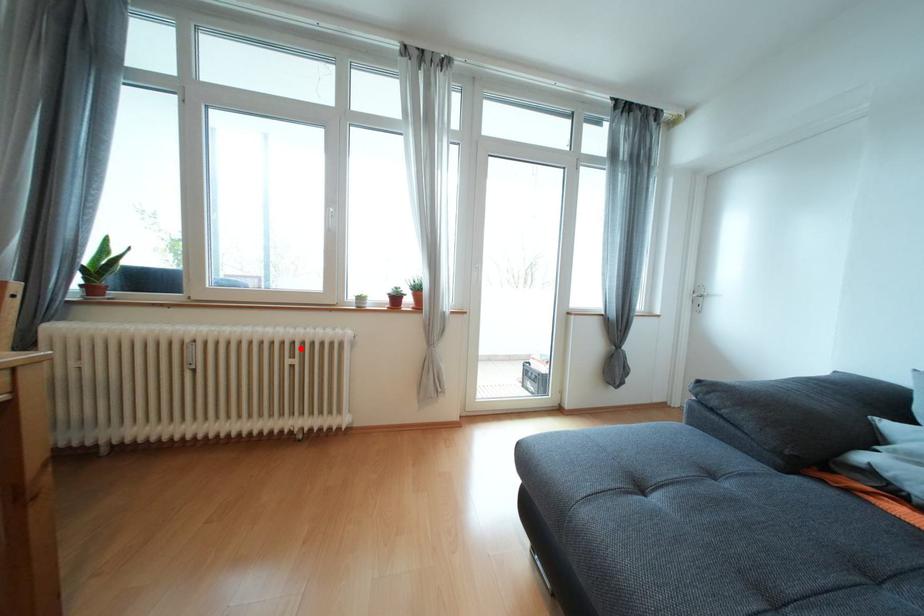
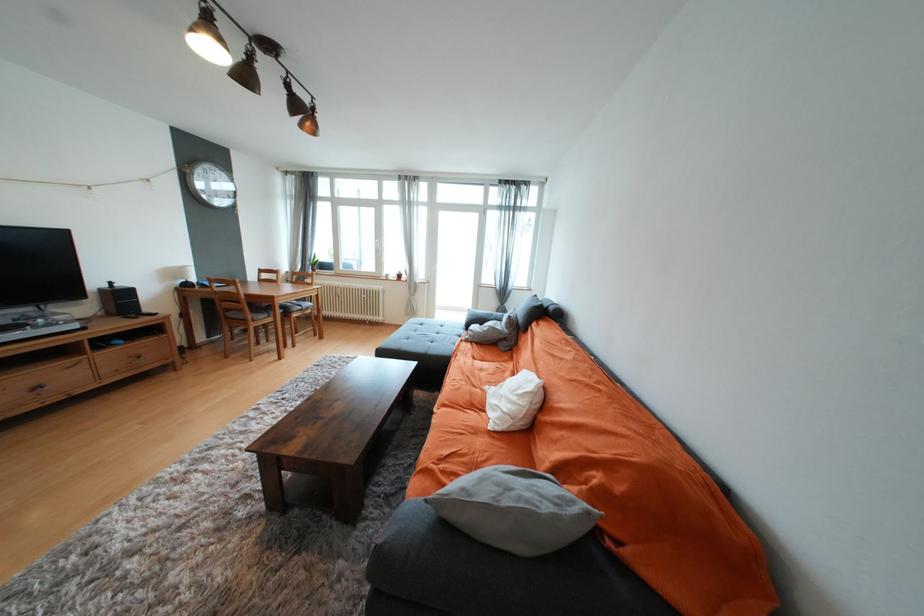
In the second image, find the point that corresponds to the highlighted location in the first image.

(371, 293)